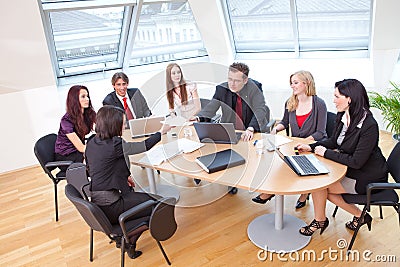
At what (x,y) coordinates should I click in order to perform the action: click on wood floor. Please return your answer as a coordinate pair (x, y). Looking at the image, I should click on click(x=205, y=236).